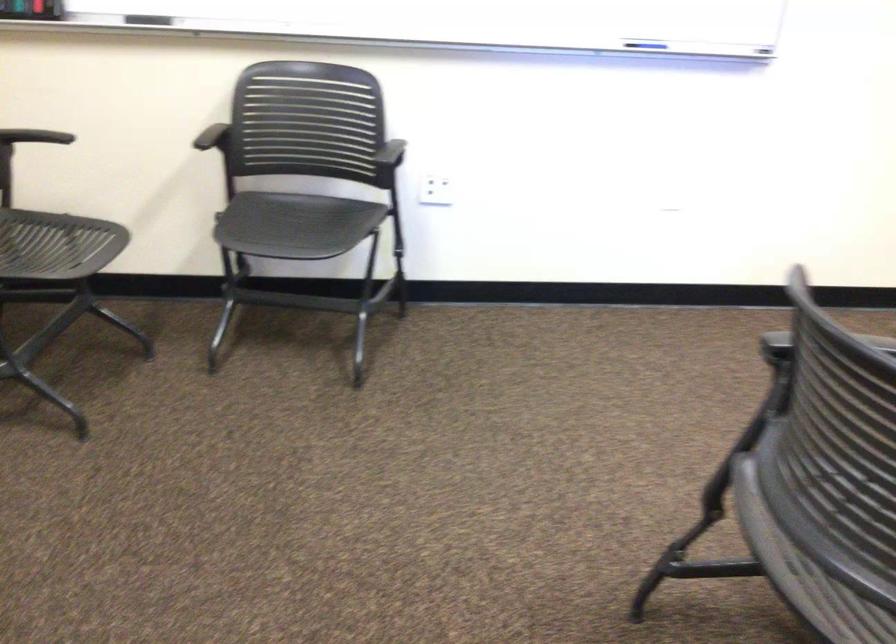
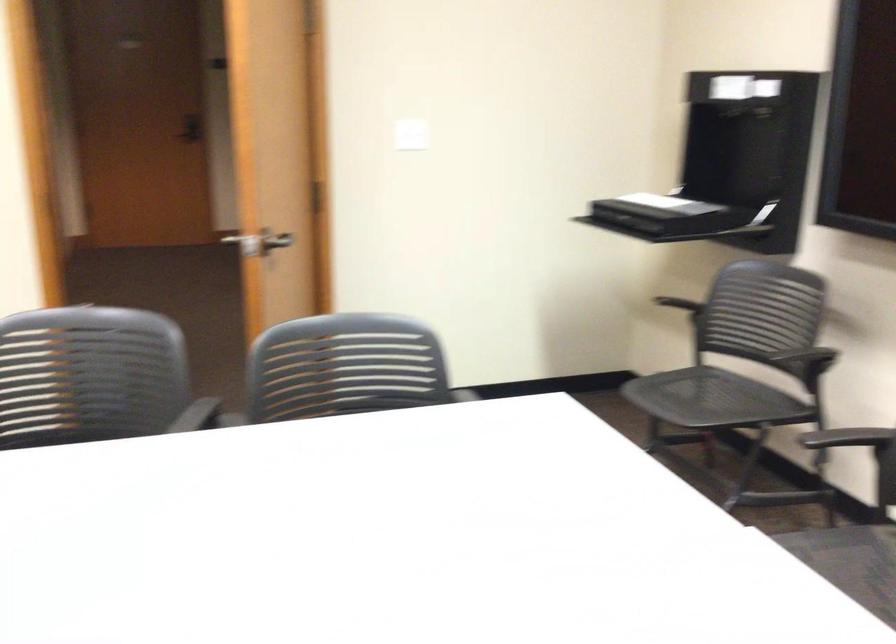
Question: Which direction would the cameraman need to move to produce the second image? Reply with the corresponding letter.

Choices:
 (A) Left
 (B) Right
 (C) Forward
 (D) Backward

Answer: (B)